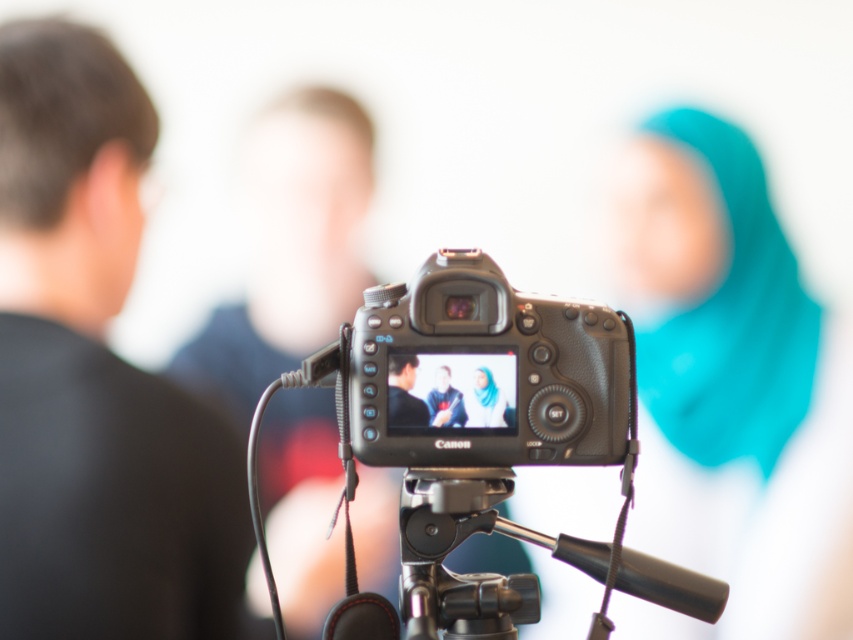
What are the coordinates of the black matte shirt at left?

The black matte shirt at left is located at point (96, 374).